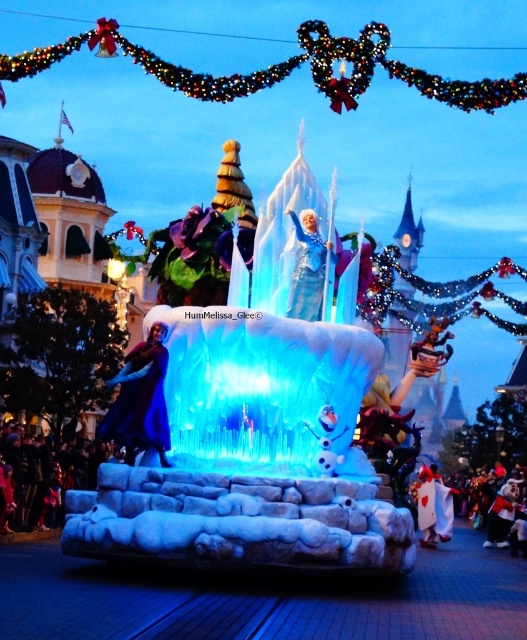
Question: Which of the following is the closest to the observer?

Choices:
 (A) velvet plush teddy bear at lower right
 (B) blue satin dress at center
 (C) matte blue gown at left
 (D) white fluffy dress at lower right

Answer: (C)

Question: Estimate the real-world distances between objects in this image. Which object is closer to the matte blue gown at left?

Choices:
 (A) white fluffy dress at lower right
 (B) dark blue fabric crowd at lower left

Answer: (B)

Question: Does icy crystal fountain at center appear under blue satin dress at center?

Choices:
 (A) no
 (B) yes

Answer: (B)

Question: Does dark blue fabric crowd at lower left come behind blue satin dress at center?

Choices:
 (A) no
 (B) yes

Answer: (B)

Question: Is blue satin dress at center to the left of velvet plush teddy bear at lower right from the viewer's perspective?

Choices:
 (A) yes
 (B) no

Answer: (A)

Question: Among these objects, which one is nearest to the camera?

Choices:
 (A) icy crystal fountain at center
 (B) blue satin dress at center

Answer: (A)